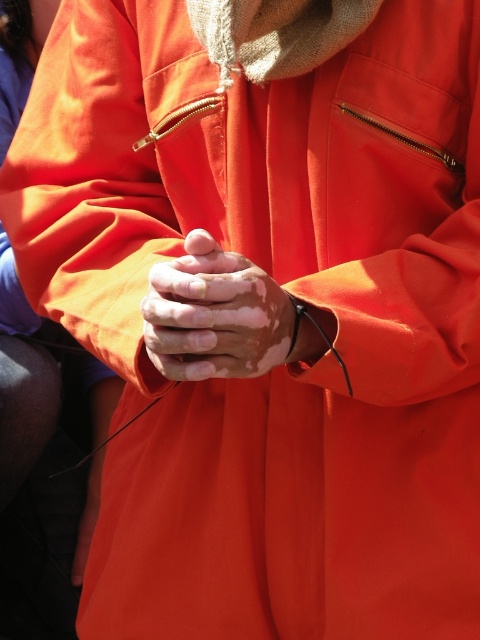
Does point (236, 326) lie behind point (84, 545)?

That is False.

Where is `smooth skin hands at center`? The height and width of the screenshot is (640, 480). smooth skin hands at center is located at coordinates (214, 314).